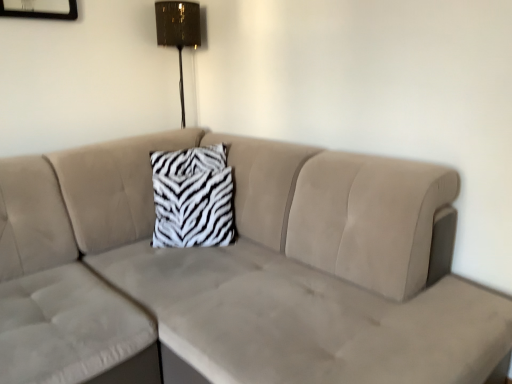
Question: From a real-world perspective, relative to zebra-patterned fabric pillow at center, is metallic gold lampshade at upper center vertically above or below?

Choices:
 (A) below
 (B) above

Answer: (B)

Question: In the image, is metallic gold lampshade at upper center positioned in front of or behind zebra-patterned fabric pillow at center?

Choices:
 (A) behind
 (B) front

Answer: (A)

Question: Which of these objects is positioned farthest from the metallic gold lampshade at upper center?

Choices:
 (A) beige velvety couch at center
 (B) zebra-patterned fabric pillow at center

Answer: (A)

Question: Which object is the closest to the zebra-patterned fabric pillow at center?

Choices:
 (A) metallic gold lampshade at upper center
 (B) beige velvety couch at center

Answer: (B)